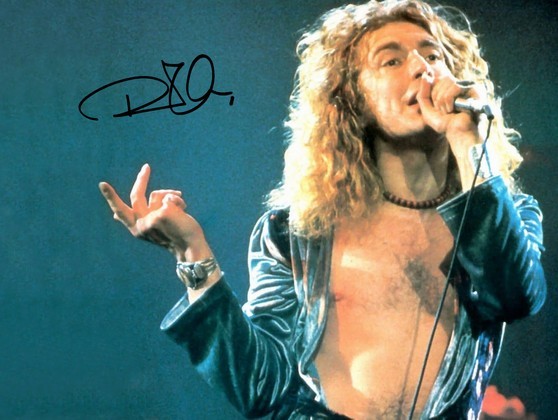
Find the location of a particular element. The height and width of the screenshot is (420, 558). chest is located at coordinates (362, 326).